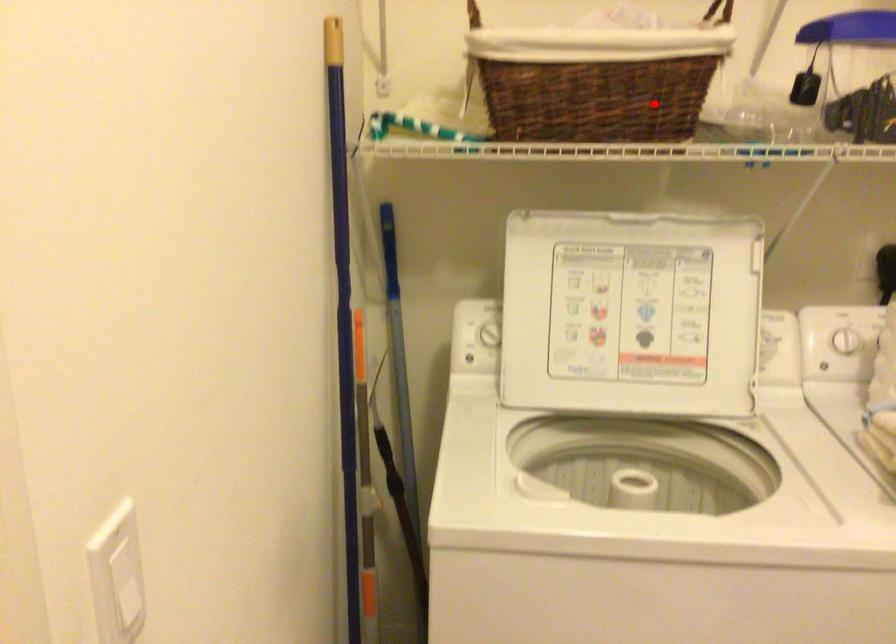
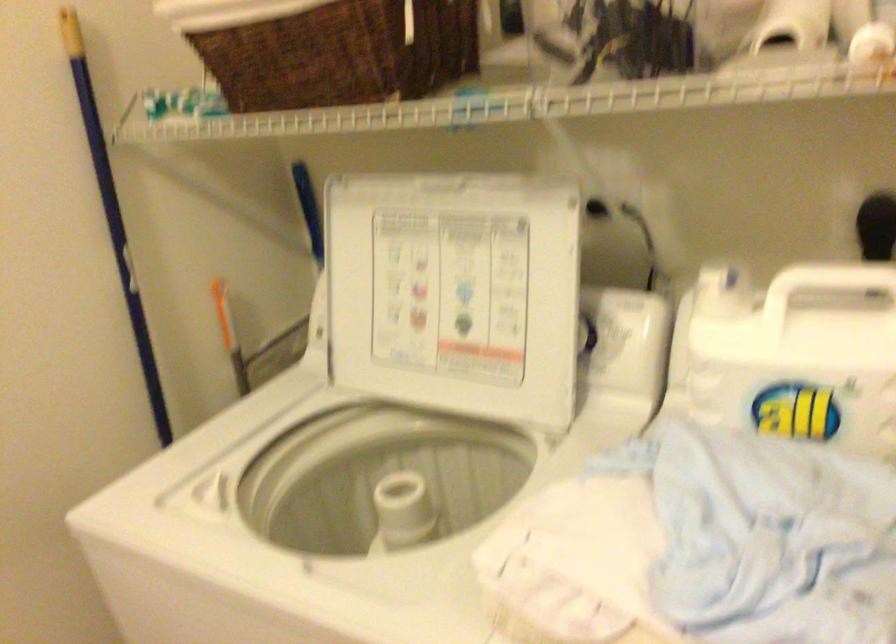
Question: I am providing you with two images of the same scene from different viewpoints. Image1 has a red point marked. In image2, the corresponding 3D location appears at what relative position? Reply with the corresponding letter.

Choices:
 (A) Closer
 (B) Farther

Answer: (A)